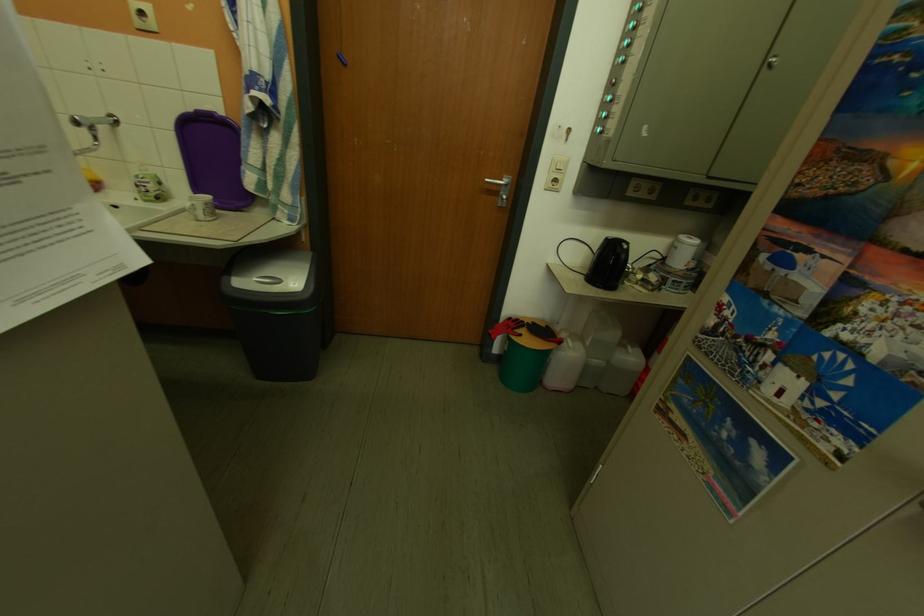
Which object does [682,252] point to?

This point indicates the white cylindrical can.